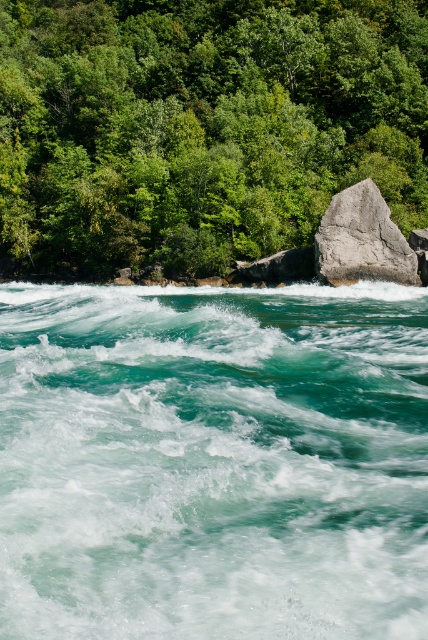
You are standing at the edge of the river in the forest scene. You notice two points marked in the image. Which point, point (122, 429) or point (400, 244), is nearer to your current position?

Point (122, 429) is closer to the camera than point (400, 244), so it is nearer to your current position.

You are standing on a path that runs parallel to the river. You see the turquoise frothy water at center and the green leafy trees at upper center. Which object is closer to your right side?

The turquoise frothy water at center is to the right of green leafy trees at upper center, so it is closer to your right side.

You are a hiker trying to cross the river using the gray rough rock at center. The green leafy trees at upper center are blocking your view. Can you see the other side of the river clearly?

The green leafy trees at upper center is much taller than the gray rough rock at center, so the trees are blocking your view of the other side of the river.